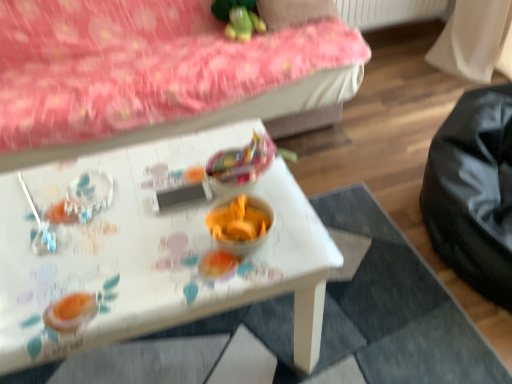
The image size is (512, 384). What are the coordinates of `blank space above white glossy table at center (from a real-world perspective)` in the screenshot? It's located at (119, 219).